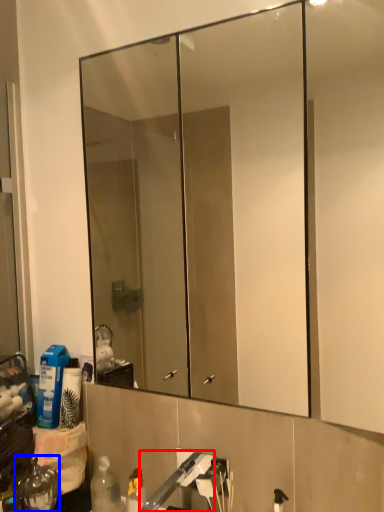
Question: Among these objects, which one is farthest to the camera, faucet (highlighted by a red box) or bottle (highlighted by a blue box)?

Choices:
 (A) faucet
 (B) bottle

Answer: (B)